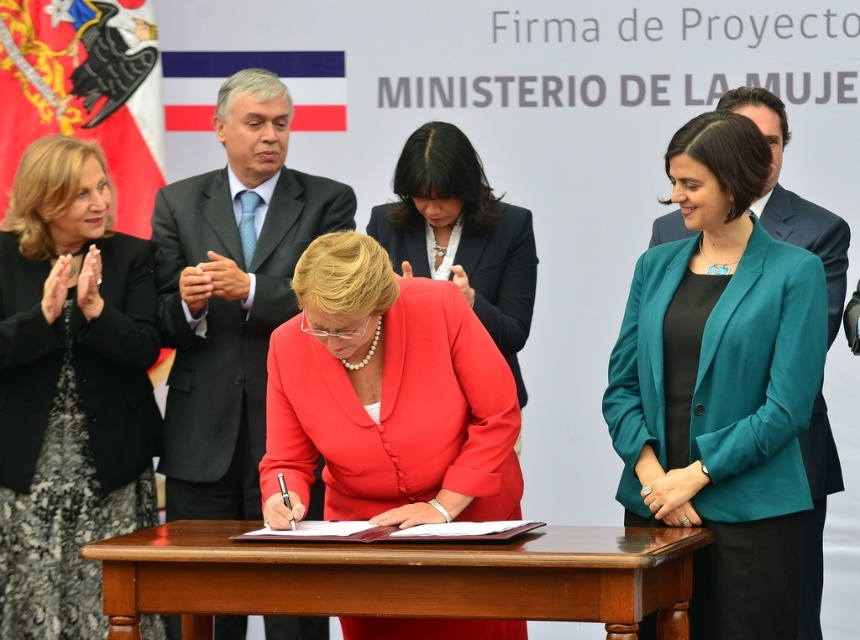
Which of these two, teal fabric jacket at center or matte red blazer at center, stands shorter?

Standing shorter between the two is matte red blazer at center.

Can you confirm if teal fabric jacket at center is positioned above matte red blazer at center?

Indeed, teal fabric jacket at center is positioned over matte red blazer at center.

Which is in front, point (673, 467) or point (445, 458)?

Point (673, 467) is more forward.

Find the location of a particular element. Image resolution: width=860 pixels, height=640 pixels. teal fabric jacket at center is located at coordinates (722, 385).

Can you confirm if teal fabric jacket at center is taller than black lace dress at upper left?

Incorrect, teal fabric jacket at center's height is not larger of black lace dress at upper left's.

This screenshot has width=860, height=640. I want to click on teal fabric jacket at center, so click(x=722, y=385).

Is matte red blazer at center positioned behind matte black suit at center?

No, it is in front of matte black suit at center.

How far apart are matte red blazer at center and matte black suit at center?

matte red blazer at center and matte black suit at center are 1.63 meters apart from each other.

Who is more distant from viewer, (484,451) or (164,486)?

Point (164,486)

Locate an element on the screen. Image resolution: width=860 pixels, height=640 pixels. matte red blazer at center is located at coordinates (387, 396).